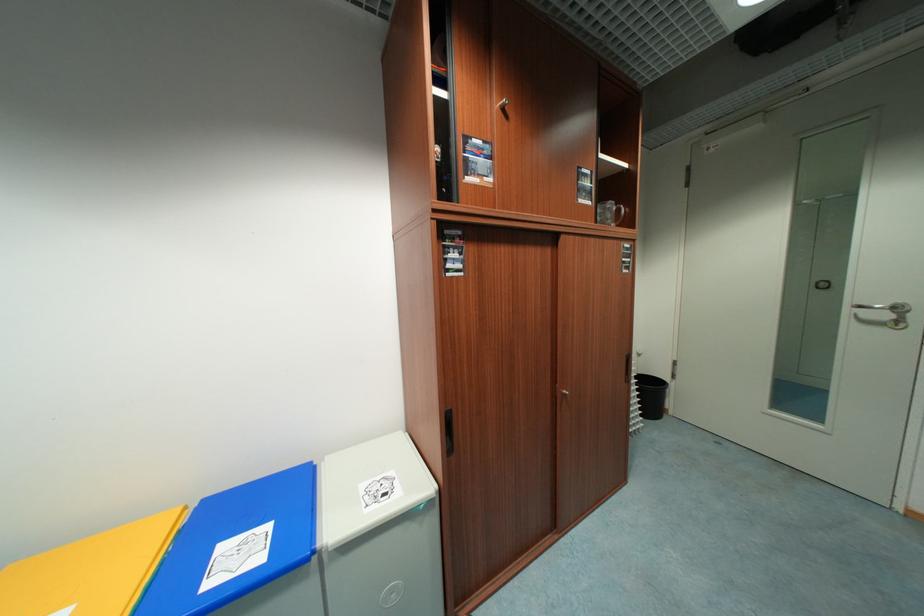
Identify the location of gray bin lid. (371, 485).